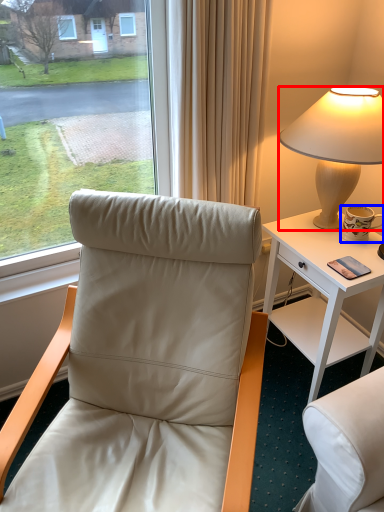
Question: Which object is closer to the camera taking this photo, lamp (highlighted by a red box) or coffee cup (highlighted by a blue box)?

Choices:
 (A) lamp
 (B) coffee cup

Answer: (A)